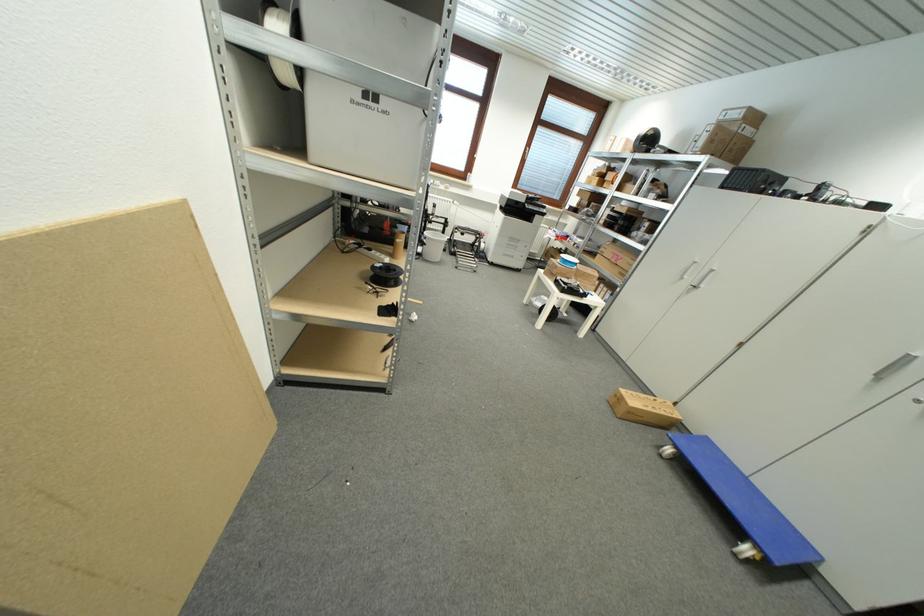
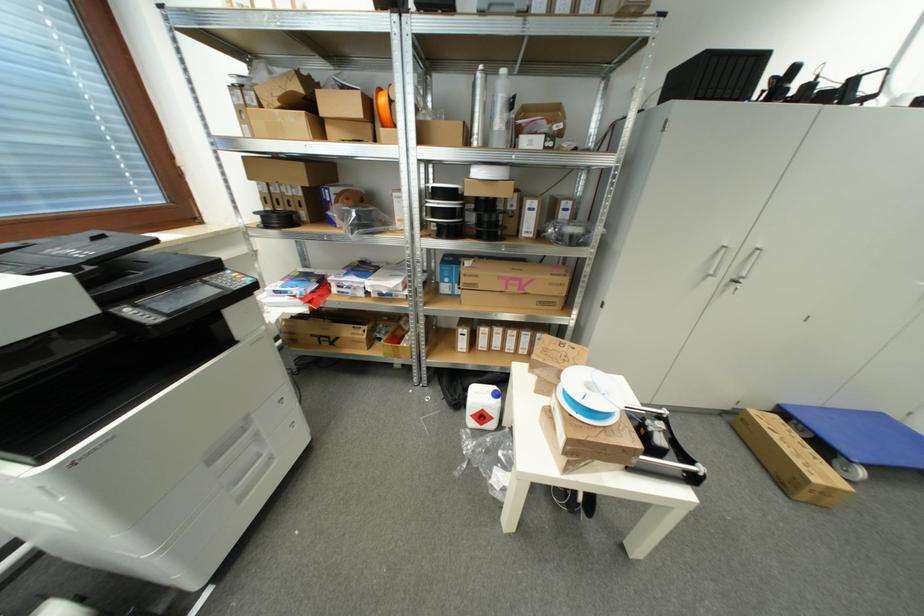
Find the pixel in the second image that matches point (626, 228) in the first image.

(493, 225)